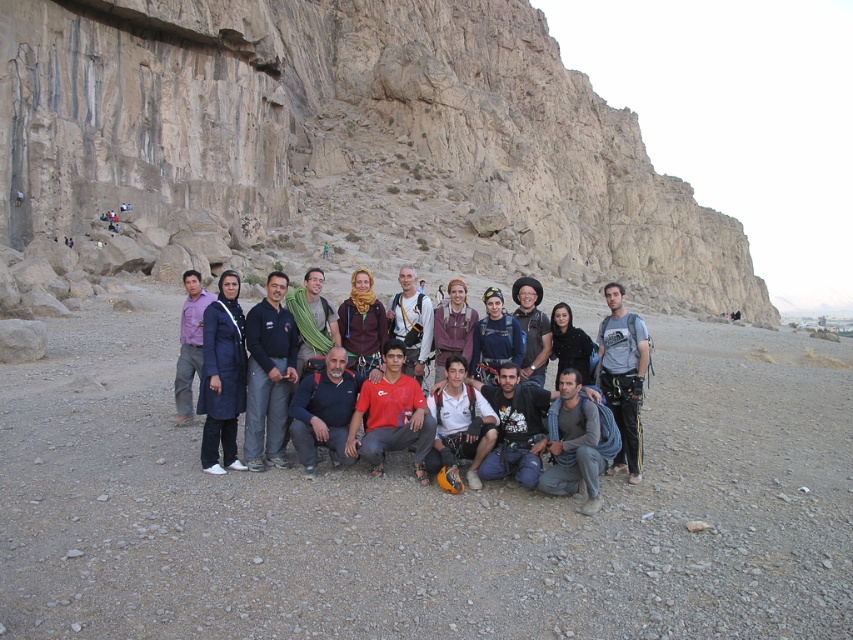
You are standing at the base of the cliff and want to take a photo of two specific points marked on the cliff face. The first point is at coordinates point (x=210, y=417) and the second is at point (x=521, y=440). Which point will appear larger in your photo?

Point (x=210, y=417) will appear larger in the photo because it is closer to the camera than point (x=521, y=440).

You are a photographer trying to capture a group photo of the matte gray backpack at center. Since you want to ensure the backpack is in the frame, where should you position yourself relative to the group?

The matte gray backpack at center is located at point (410, 323), so you should position yourself directly in front of the group to ensure the backpack is centered in your frame.